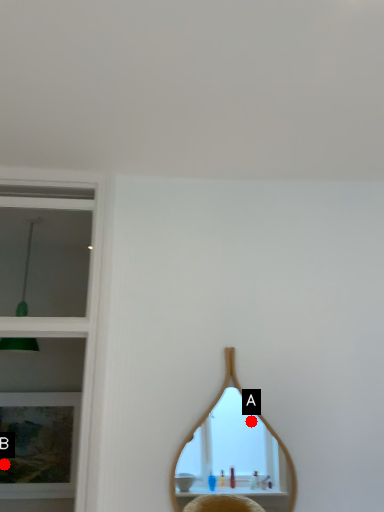
Question: Two points are circled on the image, labeled by A and B beside each circle. Among these points, which one is farthest from the camera?

Choices:
 (A) A is further
 (B) B is further

Answer: (A)